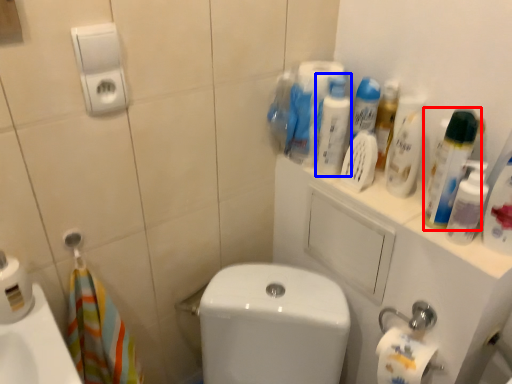
Question: Which point is further to the camera, cleaning product (highlighted by a red box) or cleaning product (highlighted by a blue box)?

Choices:
 (A) cleaning product
 (B) cleaning product

Answer: (B)